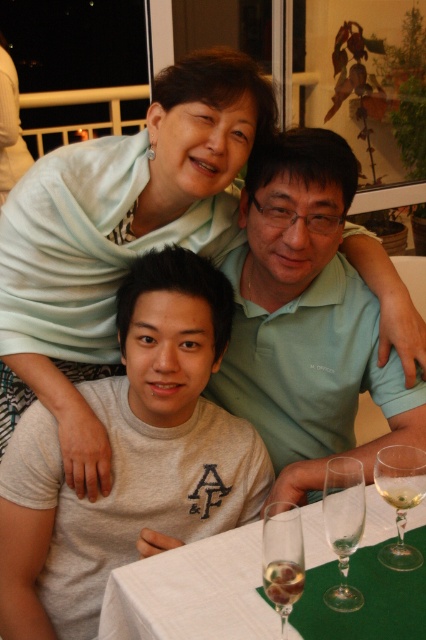
You are at a table with three people and want to place a napkin under the clear glass wine glass at center. Where should you put it relative to the people?

The clear glass wine glass at center is located at point (344, 524), so you should place the napkin directly under it at that coordinate to ensure it stays in place.

You are a photographer standing at the camera position. You want to take a photo of the clear glass wine glass at lower right. Can you reach it with your hand to adjust its position without moving from where you are?

The clear glass wine glass at lower right and camera are 3.31 feet apart. Since the distance is 3.31 feet, it is unlikely you can reach it with your hand without moving from the camera position.